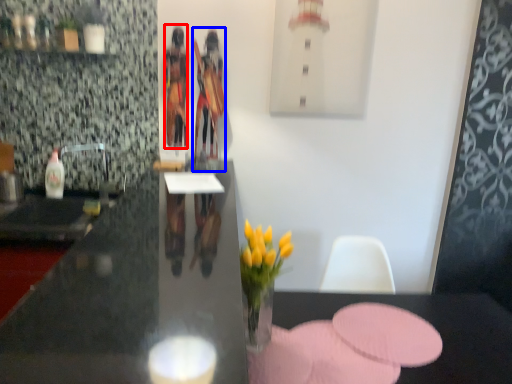
Question: Which point is further to the camera, person (highlighted by a red box) or person (highlighted by a blue box)?

Choices:
 (A) person
 (B) person

Answer: (A)